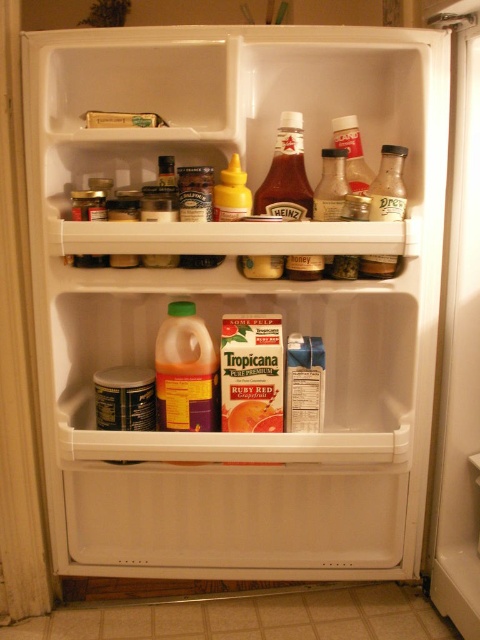
You are organizing the fridge and need to place a new 6 inch wide container between the translucent glass bottle at upper right and the smooth glass bottle of heinz ketchup at center. Is there enough space?

The distance between the translucent glass bottle at upper right and the smooth glass bottle of heinz ketchup at center is 4.78 inches, which is less than the 6 inch width of the container. Therefore, there is not enough space to place the container between them.